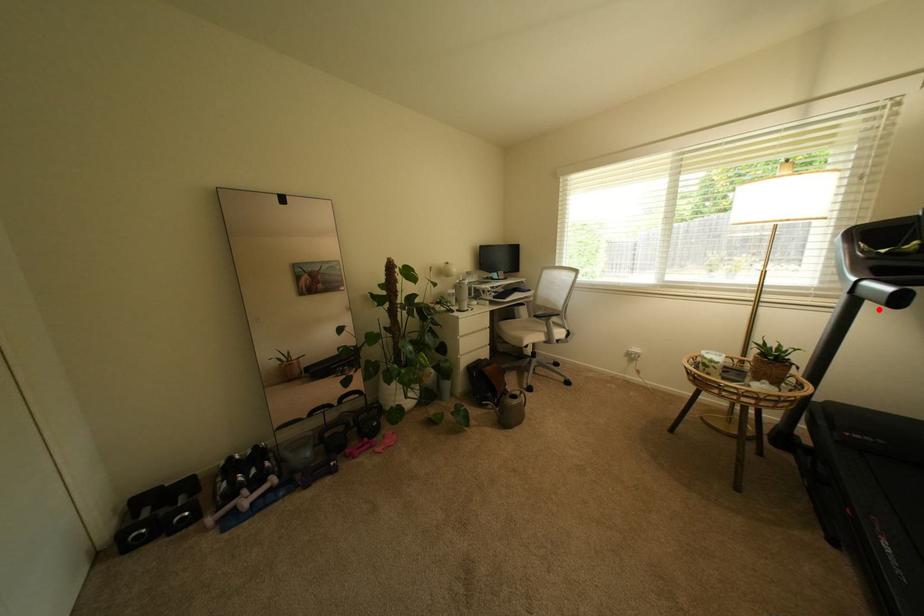
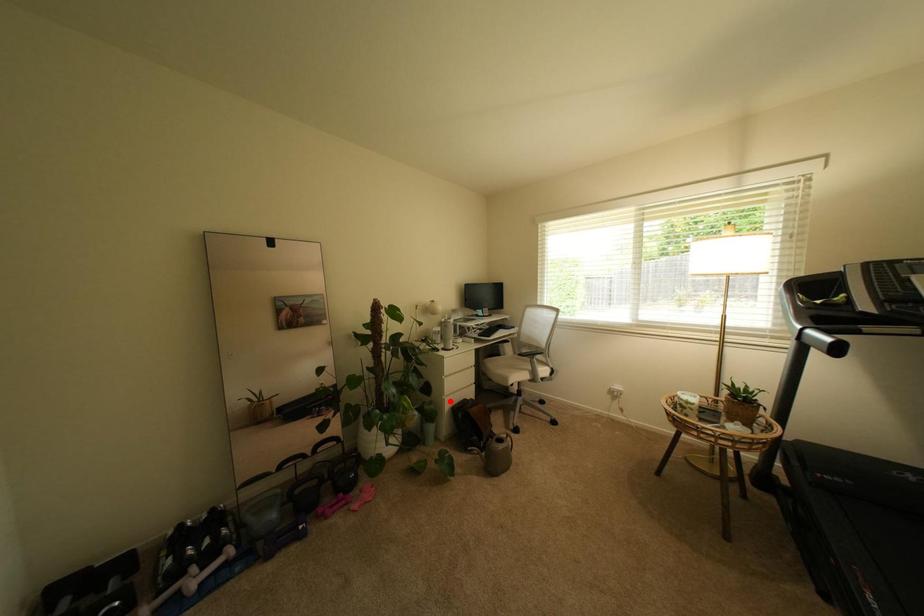
I am providing you with two images of the same scene from different viewpoints. A red point is marked on the first image and another point is marked on the second image. Is the marked point in image1 the same physical position as the marked point in image2?

No